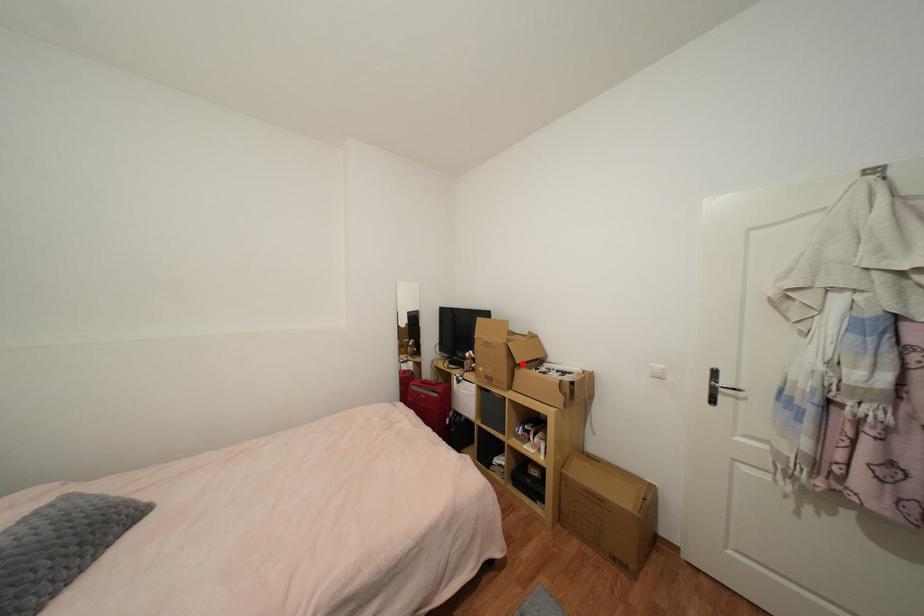
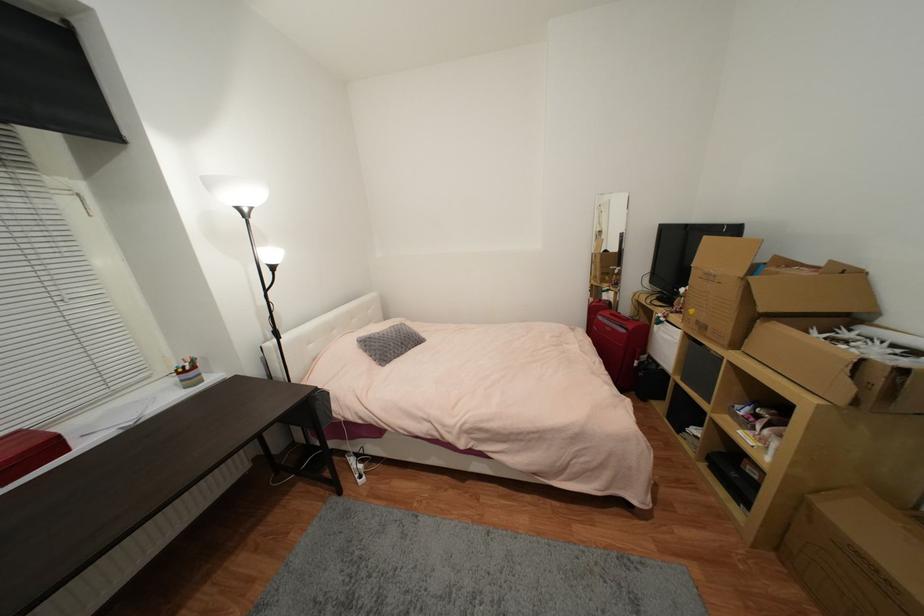
Find the pixel in the second image that matches the highlighted location in the first image.

(767, 310)